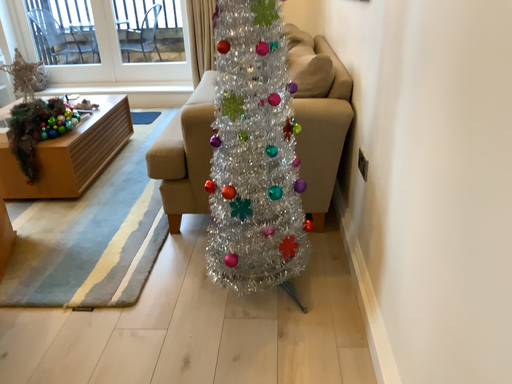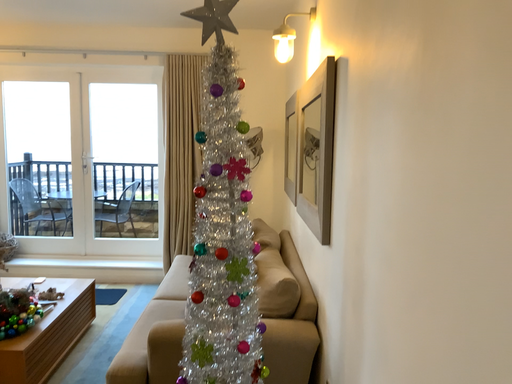
Question: Which way did the camera rotate in the video?

Choices:
 (A) rotated upward
 (B) rotated downward

Answer: (A)